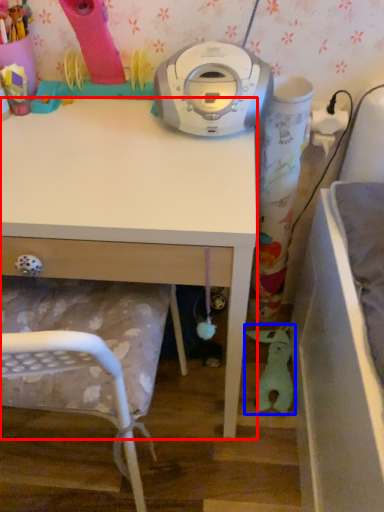
Question: Which object appears closest to the camera in this image, desk (highlighted by a red box) or toy (highlighted by a blue box)?

Choices:
 (A) desk
 (B) toy

Answer: (A)